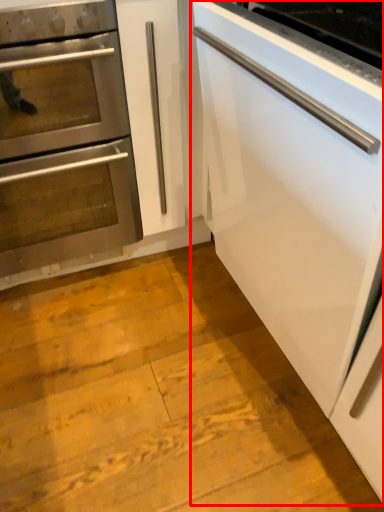
Question: In this image, where is cabinetry (annotated by the red box) located relative to oven?

Choices:
 (A) right
 (B) left

Answer: (A)